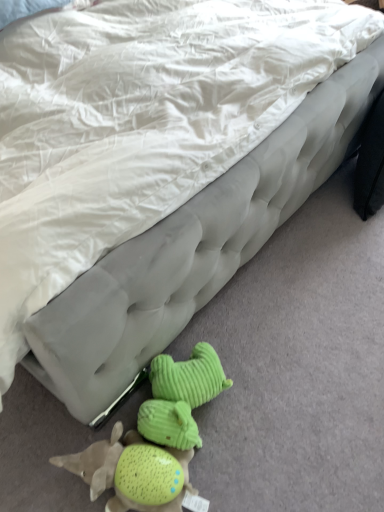
The image size is (384, 512). What do you see at coordinates (154, 438) in the screenshot? I see `green corduroy plush at lower left` at bounding box center [154, 438].

The image size is (384, 512). Find the location of `green corduroy plush at lower left`. green corduroy plush at lower left is located at coordinates (154, 438).

In order to click on green corduroy plush at lower left in this screenshot , I will do `click(154, 438)`.